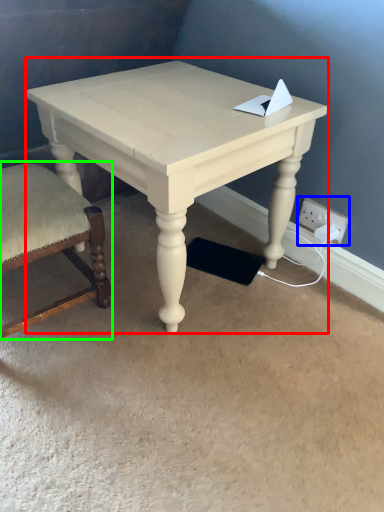
Question: Considering the real-world distances, which object is farthest from table (highlighted by a red box)? electric outlet (highlighted by a blue box) or chair (highlighted by a green box)?

Choices:
 (A) electric outlet
 (B) chair

Answer: (A)